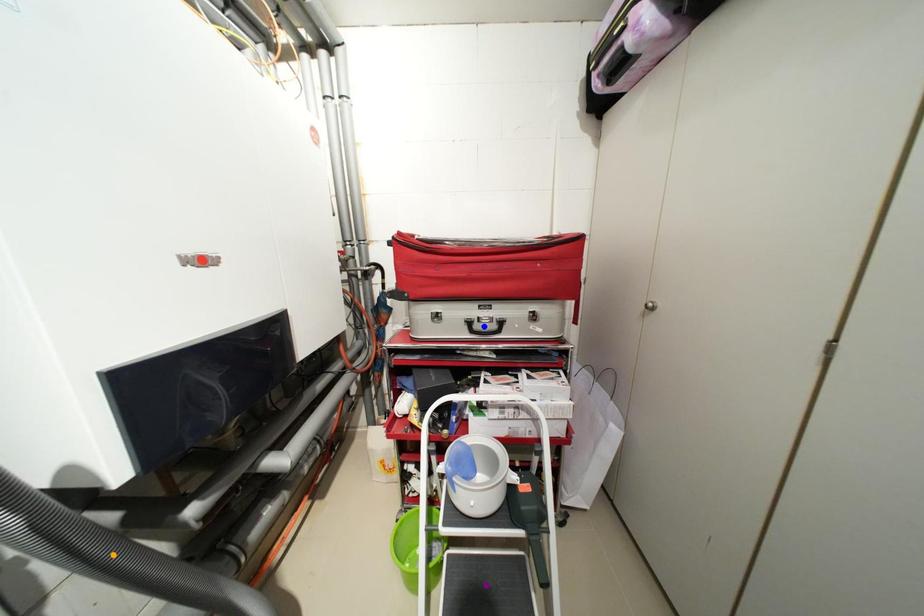
Order these from nearest to farthest:
purple point, orange point, blue point

orange point → purple point → blue point